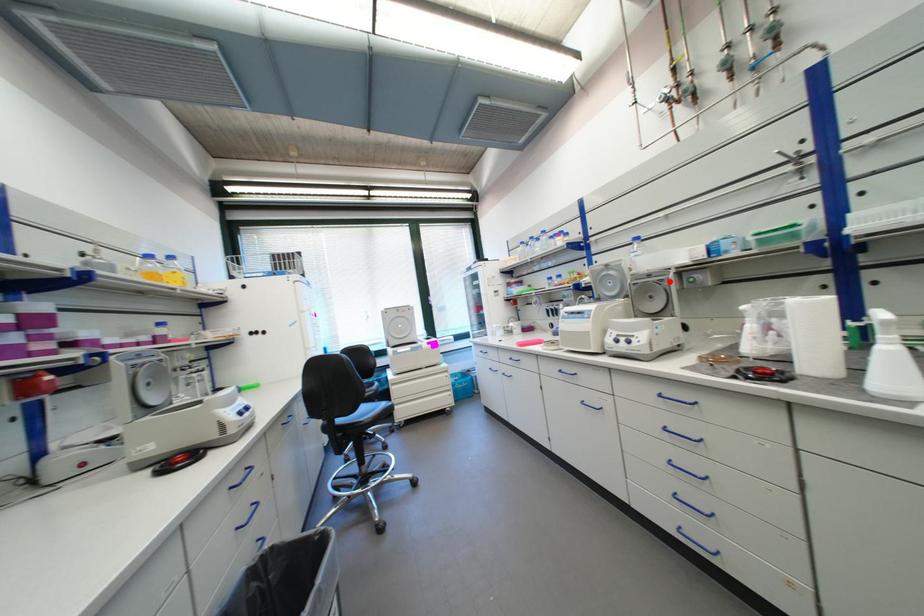
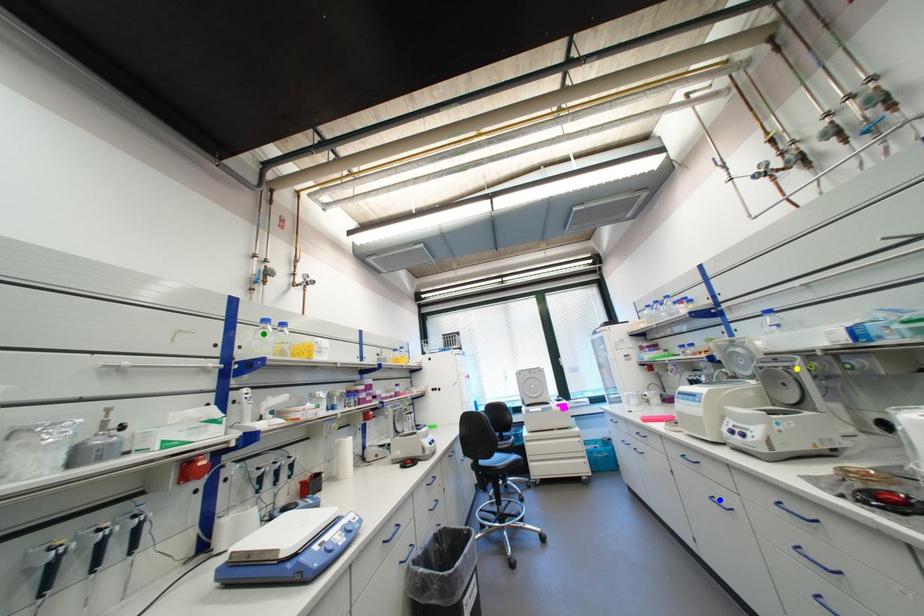
Question: I am providing you with two images of the same scene from different viewpoints. A red point is marked on the first image. You are given multiple points on the second image. In image 2, which mark is for the same physical point as the one in image 1?

Choices:
 (A) green point
 (B) blue point
 (C) yellow point

Answer: (C)